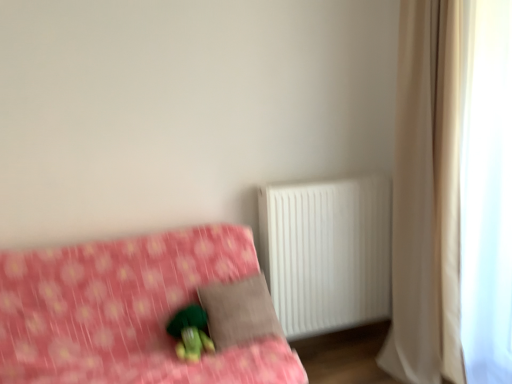
Question: From the image's perspective, is white plastic radiator at right over green plush toy at lower center?

Choices:
 (A) no
 (B) yes

Answer: (B)

Question: Would you say white plastic radiator at right is outside green plush toy at lower center?

Choices:
 (A) no
 (B) yes

Answer: (B)

Question: Is white plastic radiator at right oriented away from green plush toy at lower center?

Choices:
 (A) no
 (B) yes

Answer: (A)

Question: Does white plastic radiator at right appear on the right side of green plush toy at lower center?

Choices:
 (A) no
 (B) yes

Answer: (B)

Question: Is green plush toy at lower center located within white plastic radiator at right?

Choices:
 (A) no
 (B) yes

Answer: (A)

Question: Is white plastic radiator at right shorter than green plush toy at lower center?

Choices:
 (A) yes
 (B) no

Answer: (B)

Question: From a real-world perspective, is beige fabric curtain at right under brown fabric pillow at center?

Choices:
 (A) no
 (B) yes

Answer: (A)

Question: From a real-world perspective, is beige fabric curtain at right physically above brown fabric pillow at center?

Choices:
 (A) no
 (B) yes

Answer: (B)

Question: Considering the relative positions of beige fabric curtain at right and brown fabric pillow at center in the image provided, is beige fabric curtain at right to the right of brown fabric pillow at center from the viewer's perspective?

Choices:
 (A) no
 (B) yes

Answer: (B)

Question: Is beige fabric curtain at right directly adjacent to brown fabric pillow at center?

Choices:
 (A) yes
 (B) no

Answer: (B)

Question: From the image's perspective, would you say beige fabric curtain at right is shown under brown fabric pillow at center?

Choices:
 (A) no
 (B) yes

Answer: (A)

Question: Is beige fabric curtain at right positioned in front of brown fabric pillow at center?

Choices:
 (A) yes
 (B) no

Answer: (A)

Question: Are pink fabric bed at lower left and beige fabric curtain at right far apart?

Choices:
 (A) no
 (B) yes

Answer: (B)